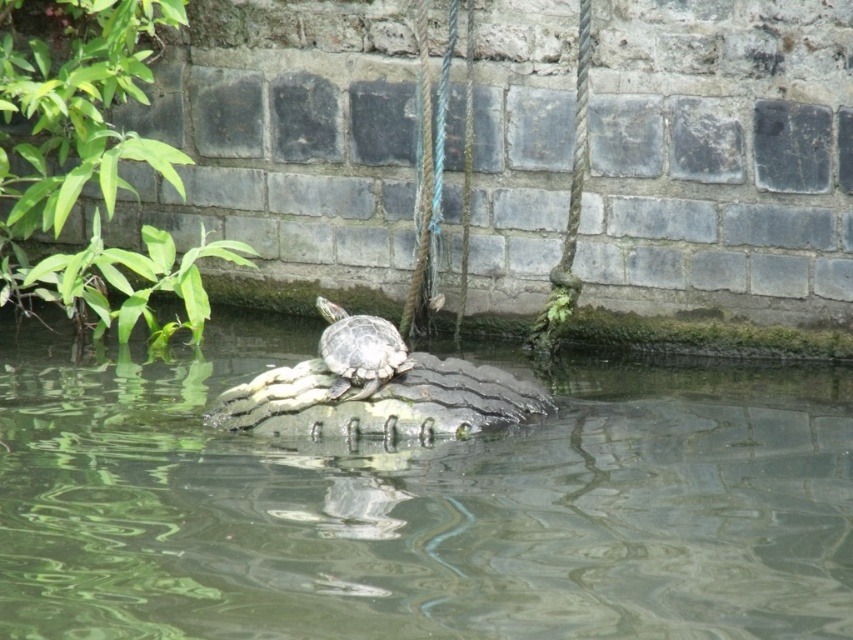
From the picture: You are a photographer trying to capture the greenish water at center and the smooth green tortoise at center in the same frame. Based on the scene, which object appears wider in the image?

The greenish water at center appears wider than the smooth green tortoise at center because the description states that the greenish water at center has a larger width.

You are a small boat operator navigating through the water in the scene. You need to reach a point marked by coordinates. Which object in the scene is located at point (x=419, y=504)?

The point (x=419, y=504) is located on the greenish water at center.